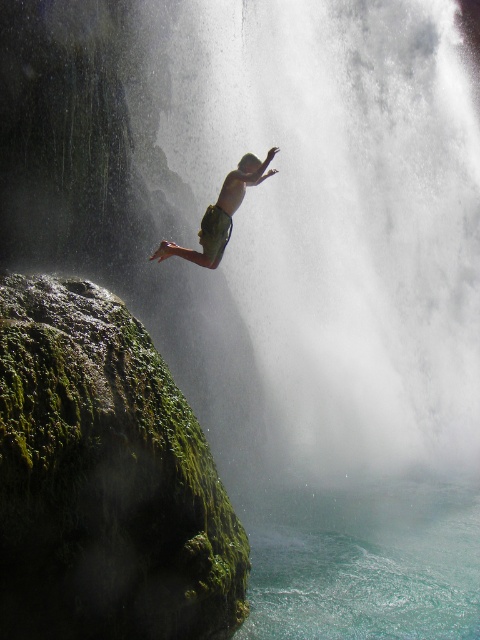
Is green mossy rock at left positioned behind green fabric shorts at center?

That is False.

Does green mossy rock at left appear under green fabric shorts at center?

Indeed, green mossy rock at left is positioned under green fabric shorts at center.

Measure the distance between green mossy rock at left and camera.

green mossy rock at left and camera are 26.18 feet apart.

Find the location of `green mossy rock at left`. green mossy rock at left is located at coordinates (105, 477).

Between point (95, 314) and point (372, 612), which one is positioned behind?

The point (372, 612) is behind.

Is point (227, 548) more distant than point (351, 593)?

No, it is not.

I want to click on green mossy rock at left, so click(105, 477).

Who is positioned more to the right, turquoise liquid at lower center or green fabric shorts at center?

turquoise liquid at lower center

Which is in front, point (428, 563) or point (216, 224)?

Positioned in front is point (216, 224).

Locate an element on the screen. Image resolution: width=480 pixels, height=640 pixels. turquoise liquid at lower center is located at coordinates (362, 561).